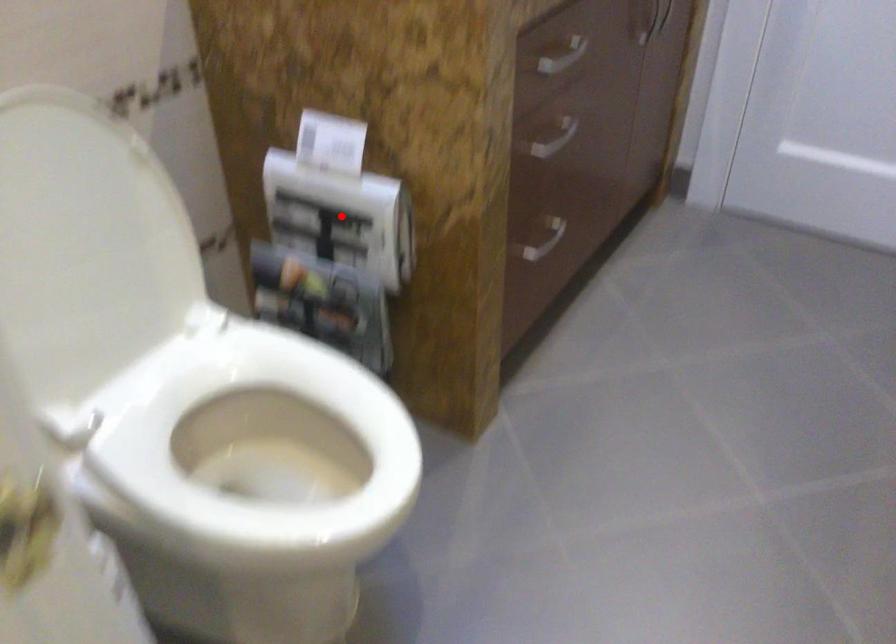
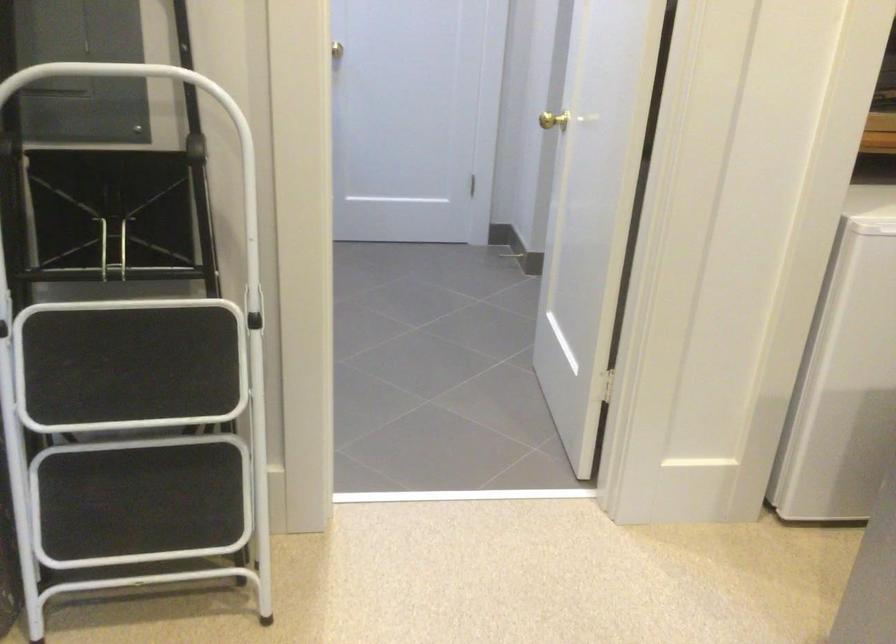
Question: I am providing you with two images of the same scene from different viewpoints. A red point is marked on the first image. Can you still see the location of the red point in image 2?

Choices:
 (A) Yes
 (B) No

Answer: (B)